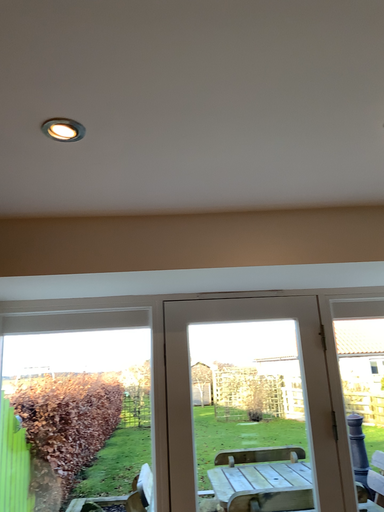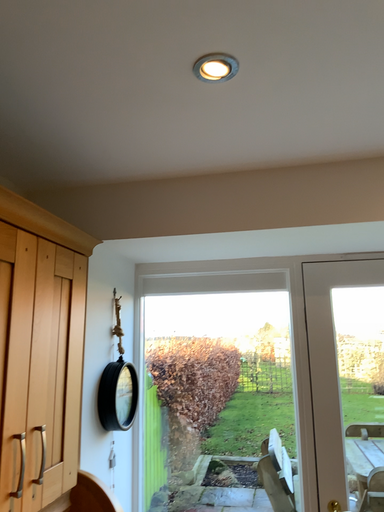
Question: Which way did the camera rotate in the video?

Choices:
 (A) rotated left
 (B) rotated right

Answer: (A)